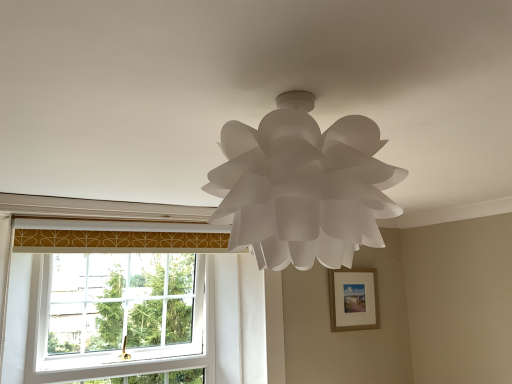
Question: From a real-world perspective, is wooden picture frame at center-right on white paper lamp at center?

Choices:
 (A) yes
 (B) no

Answer: (B)

Question: Considering the relative sizes of wooden picture frame at center-right and white paper lamp at center in the image provided, is wooden picture frame at center-right taller than white paper lamp at center?

Choices:
 (A) no
 (B) yes

Answer: (B)

Question: Is wooden picture frame at center-right directly adjacent to white paper lamp at center?

Choices:
 (A) yes
 (B) no

Answer: (B)

Question: Is wooden picture frame at center-right positioned beyond the bounds of white paper lamp at center?

Choices:
 (A) yes
 (B) no

Answer: (A)

Question: Is white paper lamp at center at the back of wooden picture frame at center-right?

Choices:
 (A) yes
 (B) no

Answer: (B)

Question: Considering the positions of white paper lamp at center and white plastic window at lower left in the image, is white paper lamp at center taller or shorter than white plastic window at lower left?

Choices:
 (A) tall
 (B) short

Answer: (B)

Question: In the image, is white paper lamp at center positioned in front of or behind white plastic window at lower left?

Choices:
 (A) behind
 (B) front

Answer: (B)

Question: Is point (393, 211) closer or farther from the camera than point (32, 326)?

Choices:
 (A) farther
 (B) closer

Answer: (B)

Question: From a real-world perspective, relative to white plastic window at lower left, is white paper lamp at center vertically above or below?

Choices:
 (A) below
 (B) above

Answer: (B)

Question: From a real-world perspective, is white plastic window at lower left physically located above or below white paper lamp at center?

Choices:
 (A) below
 (B) above

Answer: (A)

Question: Is white plastic window at lower left bigger or smaller than white paper lamp at center?

Choices:
 (A) small
 (B) big

Answer: (B)

Question: Is point (175, 332) positioned closer to the camera than point (272, 264)?

Choices:
 (A) closer
 (B) farther

Answer: (B)

Question: Relative to white paper lamp at center, is white plastic window at lower left in front or behind?

Choices:
 (A) front
 (B) behind

Answer: (B)

Question: Looking at their shapes, would you say white paper lamp at center is wider or thinner than wooden picture frame at center-right?

Choices:
 (A) wide
 (B) thin

Answer: (A)

Question: In terms of height, does white paper lamp at center look taller or shorter compared to wooden picture frame at center-right?

Choices:
 (A) tall
 (B) short

Answer: (B)